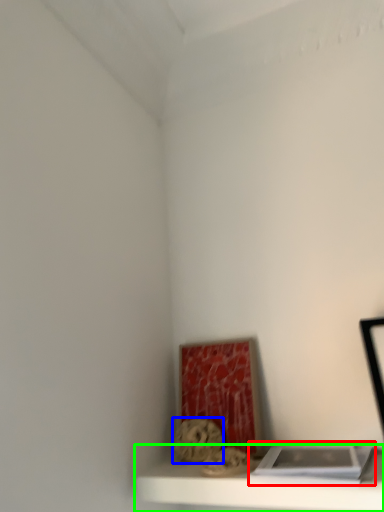
Question: Considering the real-world distances, which object is farthest from book (highlighted by a red box)? art (highlighted by a blue box) or shelf (highlighted by a green box)?

Choices:
 (A) art
 (B) shelf

Answer: (A)